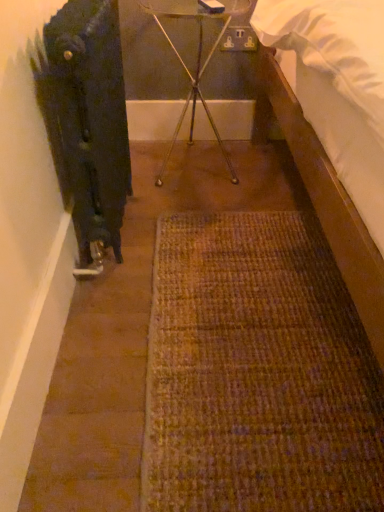
What do you see at coordinates (88, 119) in the screenshot? I see `black matte radiator at left` at bounding box center [88, 119].

What is the approximate width of black matte radiator at left?

The width of black matte radiator at left is 5.70 inches.

Image resolution: width=384 pixels, height=512 pixels. Find the location of `black matte radiator at left`. black matte radiator at left is located at coordinates (88, 119).

I want to click on metallic tripod at center, so click(x=197, y=56).

Measure the distance between point (208,62) and camera.

Point (208,62) and camera are 5.65 feet apart from each other.

This screenshot has width=384, height=512. Describe the element at coordinates (197, 56) in the screenshot. I see `metallic tripod at center` at that location.

The width and height of the screenshot is (384, 512). I want to click on black matte radiator at left, so click(88, 119).

Consider the image. Which object is positioned more to the left, black matte radiator at left or metallic tripod at center?

From the viewer's perspective, black matte radiator at left appears more on the left side.

Considering the positions of objects black matte radiator at left and metallic tripod at center in the image provided, who is in front, black matte radiator at left or metallic tripod at center?

black matte radiator at left.

Considering the points (131, 188) and (168, 14), which point is behind, point (131, 188) or point (168, 14)?

The point (168, 14) is farther from the camera.

From the image's perspective, which is above, black matte radiator at left or metallic tripod at center?

From the image's view, metallic tripod at center is above.

From a real-world perspective, does black matte radiator at left sit lower than metallic tripod at center?

Incorrect, from a real-world perspective, black matte radiator at left is higher than metallic tripod at center.

Consider the image. Considering the relative sizes of black matte radiator at left and metallic tripod at center in the image provided, is black matte radiator at left wider than metallic tripod at center?

Incorrect, the width of black matte radiator at left does not surpass that of metallic tripod at center.

Considering the sizes of objects black matte radiator at left and metallic tripod at center in the image provided, who is shorter, black matte radiator at left or metallic tripod at center?

Result: Standing shorter between the two is metallic tripod at center.

Considering the relative sizes of black matte radiator at left and metallic tripod at center in the image provided, is black matte radiator at left smaller than metallic tripod at center?

Indeed, black matte radiator at left has a smaller size compared to metallic tripod at center.

Can metallic tripod at center be found inside black matte radiator at left?

No, metallic tripod at center is located outside of black matte radiator at left.

Is black matte radiator at left positioned far away from metallic tripod at center?

No, there isn't a large distance between black matte radiator at left and metallic tripod at center.

Is black matte radiator at left positioned with its back to metallic tripod at center?

That's not correct — black matte radiator at left is not looking away from metallic tripod at center.

Image resolution: width=384 pixels, height=512 pixels. Identify the location of tripod below the black matte radiator at left (from a real-world perspective). (197, 56).

In the scene shown: Which object is positioned more to the right, metallic tripod at center or black matte radiator at left?

From the viewer's perspective, metallic tripod at center appears more on the right side.

In the image, is metallic tripod at center positioned in front of or behind black matte radiator at left?

Clearly, metallic tripod at center is behind black matte radiator at left.

Considering the points (182, 60) and (84, 24), which point is behind, point (182, 60) or point (84, 24)?

The point (182, 60) is farther.

From the image's perspective, is metallic tripod at center located beneath black matte radiator at left?

No, from the image's perspective, metallic tripod at center is not beneath black matte radiator at left.

From a real-world perspective, relative to black matte radiator at left, is metallic tripod at center vertically above or below?

Clearly, from a real-world perspective, metallic tripod at center is below black matte radiator at left.

Which of these two, metallic tripod at center or black matte radiator at left, is thinner?

black matte radiator at left is thinner.

Considering the sizes of objects metallic tripod at center and black matte radiator at left in the image provided, who is shorter, metallic tripod at center or black matte radiator at left?

metallic tripod at center is shorter.

Based on their sizes in the image, would you say metallic tripod at center is bigger or smaller than black matte radiator at left?

Clearly, metallic tripod at center is larger in size than black matte radiator at left.

Could black matte radiator at left be considered to be inside metallic tripod at center?

Definitely not — black matte radiator at left is not inside metallic tripod at center.

Is metallic tripod at center far from black matte radiator at left?

No.

Is metallic tripod at center turned away from black matte radiator at left?

No, black matte radiator at left is not at the back of metallic tripod at center.

How many degrees apart are the facing directions of metallic tripod at center and black matte radiator at left?

metallic tripod at center and black matte radiator at left are facing 90.2 degrees away from each other.

Identify the location of tripod that appears on the right of black matte radiator at left. (197, 56).

This screenshot has height=512, width=384. What are the coordinates of `tripod above the black matte radiator at left (from the image's perspective)` in the screenshot? It's located at (197, 56).

Locate an element on the screen. This screenshot has width=384, height=512. tripod that is under the black matte radiator at left (from a real-world perspective) is located at coordinates (197, 56).